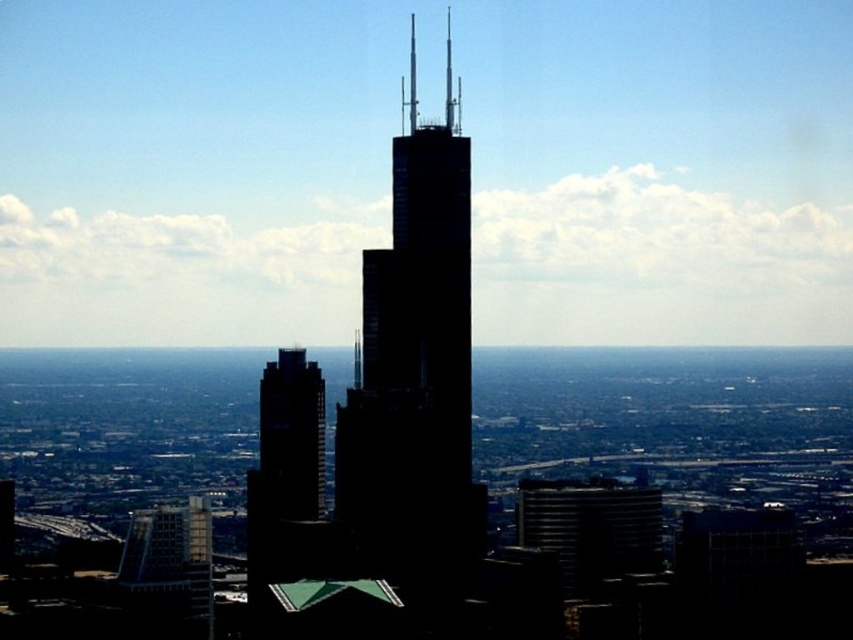
Which of these two, black glass skyscraper at center or smooth glass skyscraper at center, stands taller?

Standing taller between the two is black glass skyscraper at center.

Is black glass skyscraper at center closer to camera compared to smooth glass skyscraper at center?

Yes, black glass skyscraper at center is closer to the viewer.

Does point (405, 163) come closer to viewer compared to point (270, 483)?

Yes, it is.

The height and width of the screenshot is (640, 853). What are the coordinates of `black glass skyscraper at center` in the screenshot? It's located at (415, 364).